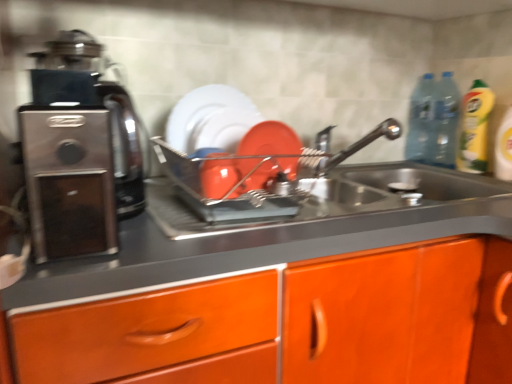
This screenshot has width=512, height=384. What are the coordinates of `free space to the left of yellow liquid bottle at right` in the screenshot? It's located at (430, 172).